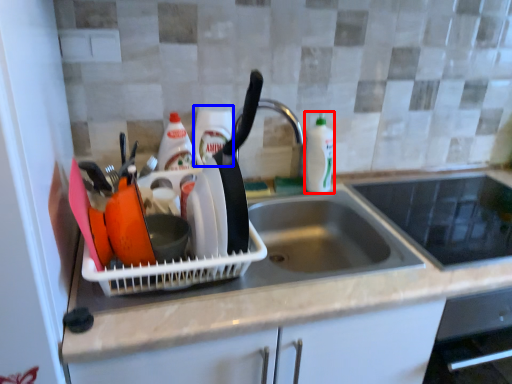
Question: Among these objects, which one is farthest to the camera, bottle (highlighted by a red box) or bottle (highlighted by a blue box)?

Choices:
 (A) bottle
 (B) bottle

Answer: (A)